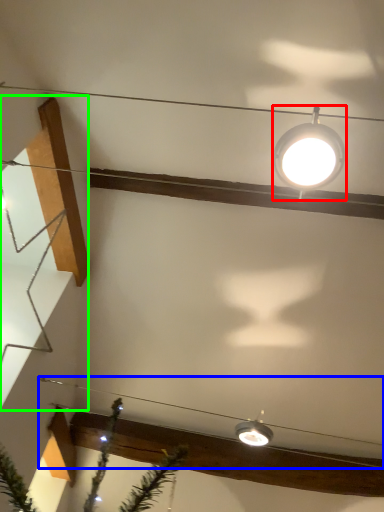
Question: Considering the real-world distances, which object is farthest from lamp (highlighted by a red box)? wire (highlighted by a blue box) or stairwell (highlighted by a green box)?

Choices:
 (A) wire
 (B) stairwell

Answer: (A)